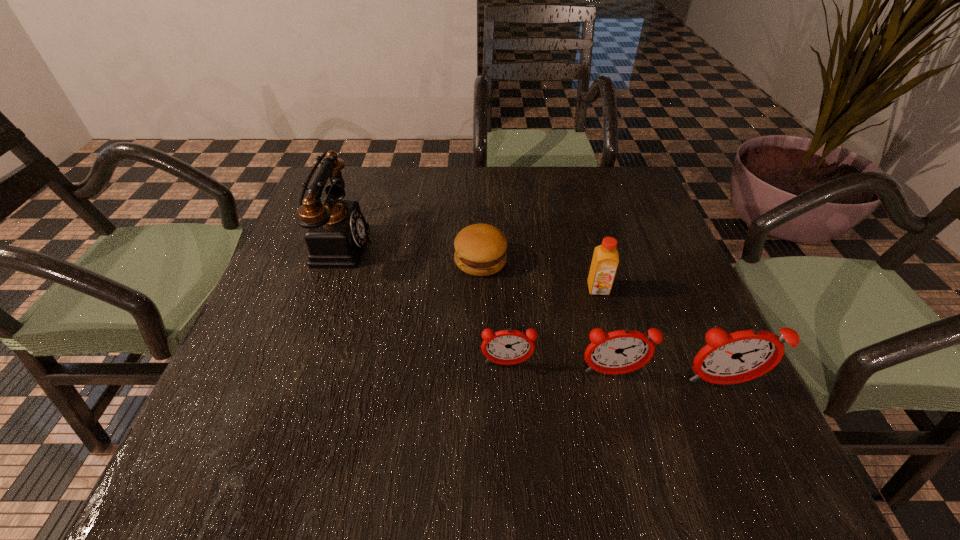
This screenshot has height=540, width=960. Identify the location of free space located on the front-facing side of the second tallest alarm clock. (625, 421).

Locate an element on the screen. The height and width of the screenshot is (540, 960). free space located on the front of the hamburger is located at coordinates (481, 298).

Find the location of a particular element. The image size is (960, 540). vacant space located 0.150m on the front of the telephone at the rotary dial is located at coordinates [x=431, y=244].

At what (x,y) coordinates should I click in order to perform the action: click on free region located on the front and back of the orange juice. Please return your answer as a coordinate pair (x, y). This screenshot has height=540, width=960. Looking at the image, I should click on (635, 423).

This screenshot has height=540, width=960. I want to click on object that is positioned at the far edge, so click(x=336, y=232).

Identify the location of object that is at the left edge. The width and height of the screenshot is (960, 540). (336, 232).

Find the location of `object located in the far left corner section of the desktop`. object located in the far left corner section of the desktop is located at coordinates (336, 232).

This screenshot has height=540, width=960. I want to click on vacant space at the far edge of the desktop, so [x=428, y=176].

Find the location of a particular element. The image size is (960, 540). free space at the near edge is located at coordinates (539, 378).

What are the coordinates of `vacant space at the left edge of the desktop` in the screenshot? It's located at (296, 243).